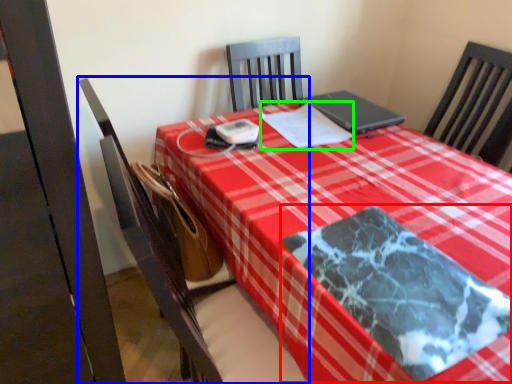
Question: Based on their relative distances, which object is nearer to blanket (highlighted by a red box)? Choose from chair (highlighted by a blue box) and notebook (highlighted by a green box).

Choices:
 (A) chair
 (B) notebook

Answer: (A)